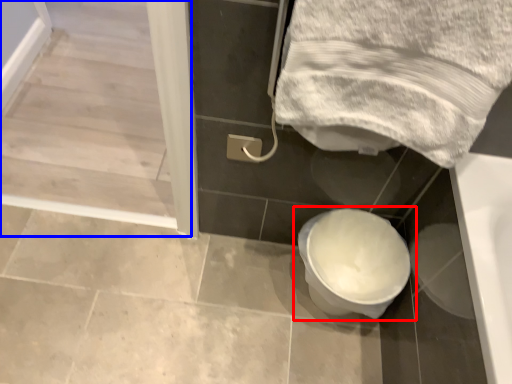
Question: Which object is further to the camera taking this photo, toilet (highlighted by a red box) or screen door (highlighted by a blue box)?

Choices:
 (A) toilet
 (B) screen door

Answer: (B)